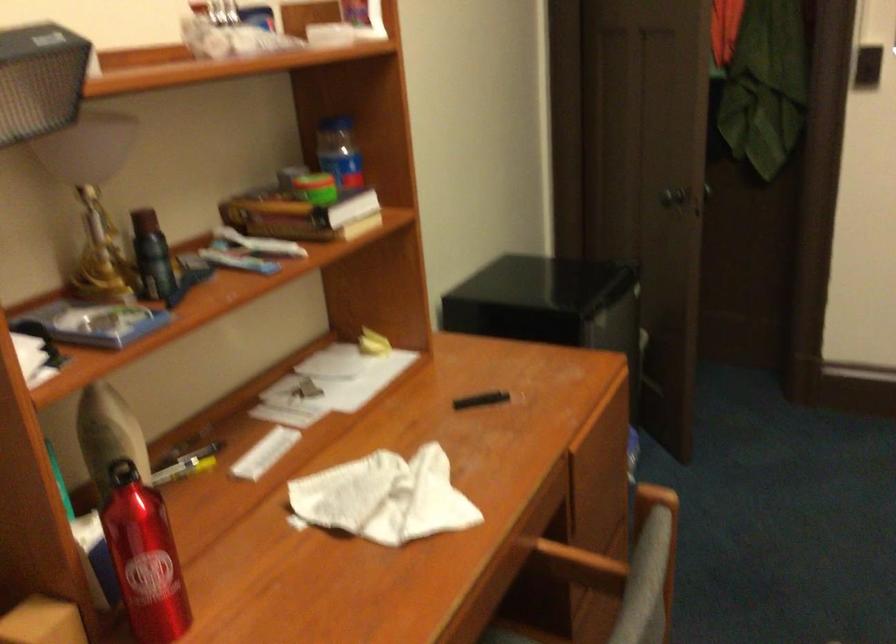
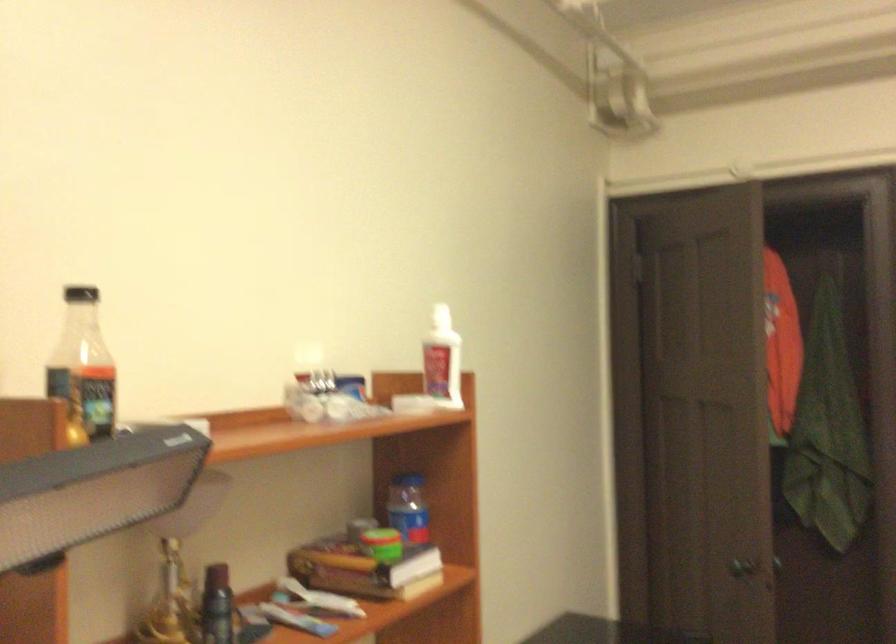
Question: The images are taken continuously from a first-person perspective. In which direction are you moving?

Choices:
 (A) Left
 (B) Right
 (C) Forward
 (D) Backward

Answer: (D)